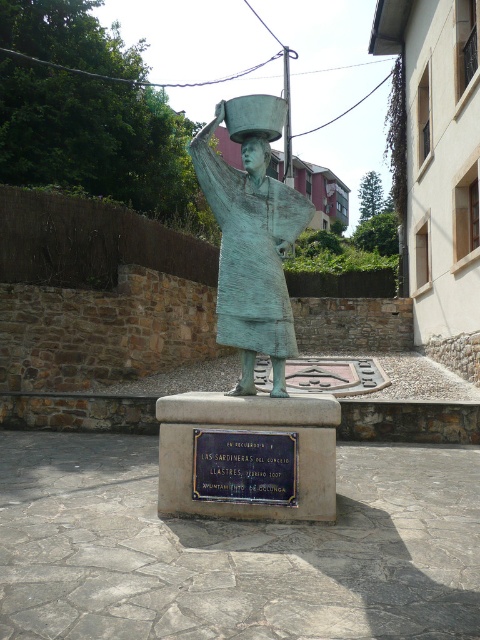
Question: Is green patina statue at center thinner than bronze plaque at center?

Choices:
 (A) yes
 (B) no

Answer: (B)

Question: From the image, what is the correct spatial relationship of green patina statue at center in relation to bronze plaque at center?

Choices:
 (A) below
 (B) above

Answer: (B)

Question: Among these objects, which one is nearest to the camera?

Choices:
 (A) bronze plaque at center
 (B) green patina statue at center

Answer: (A)

Question: From the image, what is the correct spatial relationship of green patina statue at center in relation to bronze plaque at center?

Choices:
 (A) right
 (B) left

Answer: (A)

Question: Among these points, which one is nearest to the camera?

Choices:
 (A) (x=232, y=333)
 (B) (x=240, y=442)

Answer: (B)

Question: Which point is closer to the camera taking this photo?

Choices:
 (A) (276, 228)
 (B) (283, 454)

Answer: (B)